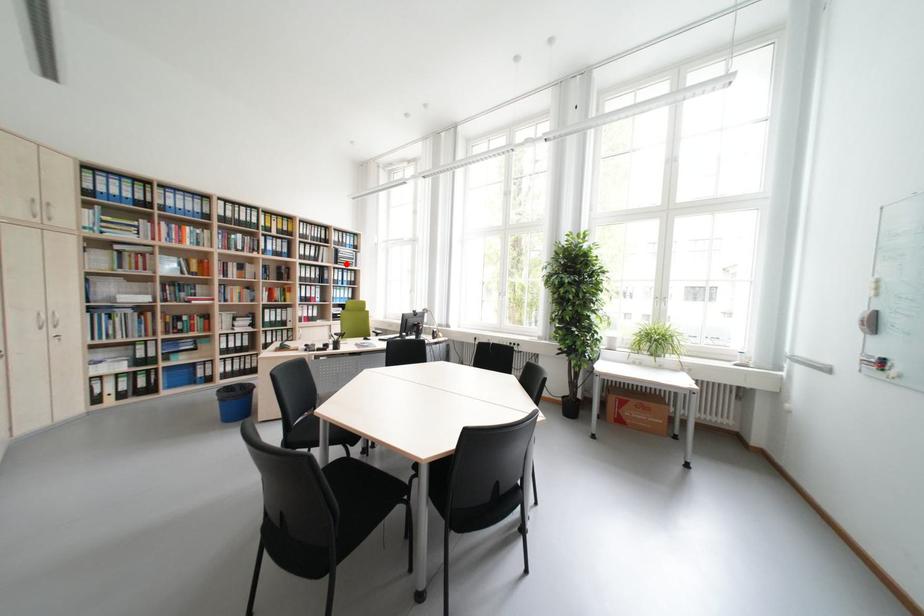
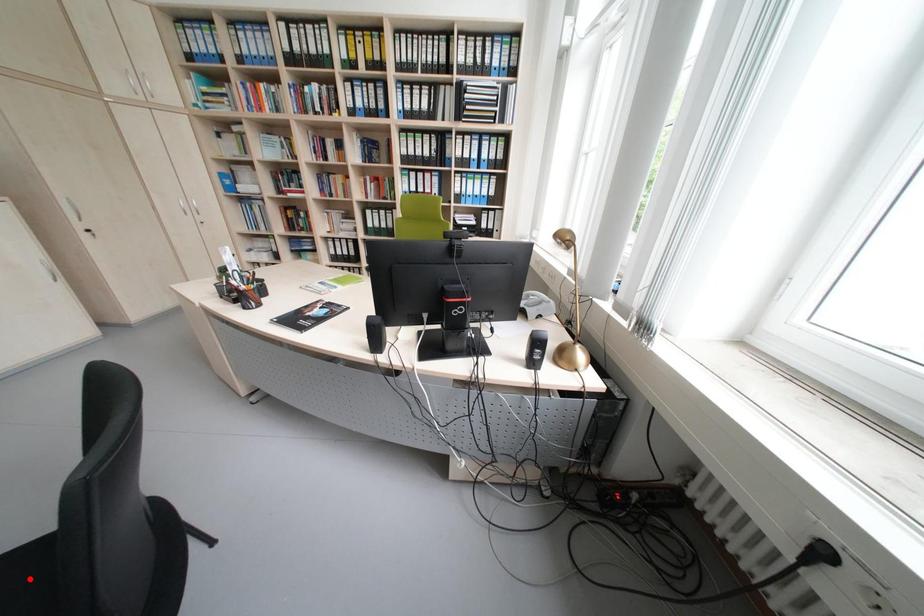
I am providing you with two images of the same scene from different viewpoints. A red point is marked on the first image and another point is marked on the second image. Are the points marked in image1 and image2 representing the same 3D position?

No